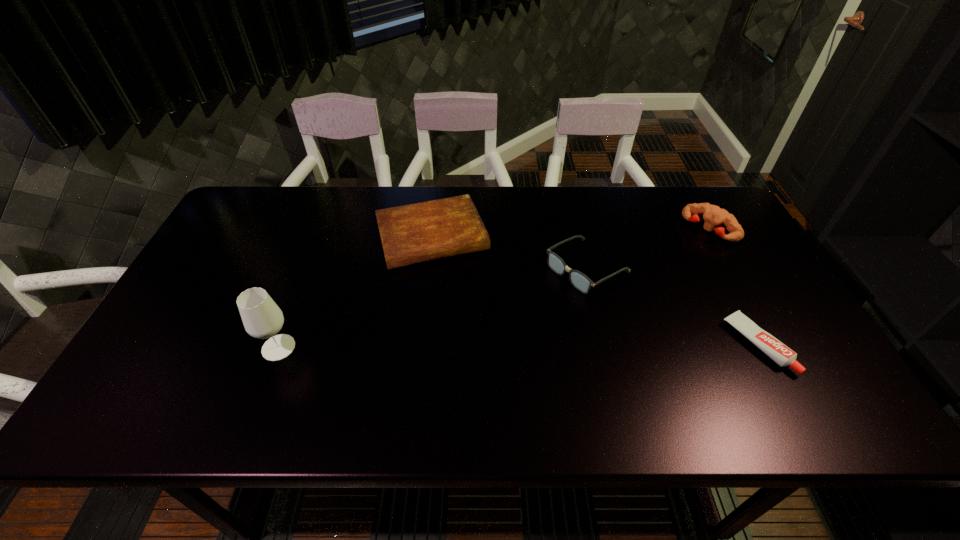
You are a GUI agent. You are given a task and a screenshot of the screen. Output one action in this format:
    pyautogui.click(x=<x>, y=<y>)
    Task: Click on the empty space between the spectacles and the Bible
    This screenshot has height=540, width=960.
    Given the screenshot: What is the action you would take?
    pyautogui.click(x=510, y=252)

The height and width of the screenshot is (540, 960). I want to click on vacant space that's between the second tallest object and the toothpaste, so click(733, 287).

Find the location of a particular element. object that stands as the fourth closest to the Bible is located at coordinates (713, 215).

Locate an element on the screen. Image resolution: width=960 pixels, height=540 pixels. object that is the closest one to the leftmost object is located at coordinates (426, 231).

Where is `blank space that satisfies the following two spatial constraints: 1. on the front side of the shortest object; 2. on the right side of the third tallest object`? The height and width of the screenshot is (540, 960). blank space that satisfies the following two spatial constraints: 1. on the front side of the shortest object; 2. on the right side of the third tallest object is located at coordinates (606, 345).

At what (x,y) coordinates should I click in order to perform the action: click on vacant space that satisfies the following two spatial constraints: 1. on the back side of the fourth tallest object; 2. on the left side of the tallest object. Please return your answer as a coordinate pair (x, y). This screenshot has width=960, height=540. Looking at the image, I should click on (321, 237).

The width and height of the screenshot is (960, 540). What are the coordinates of `vacant area in the image that satisfies the following two spatial constraints: 1. on the back side of the fourth shortest object; 2. on the left side of the toothpaste` in the screenshot? It's located at (696, 229).